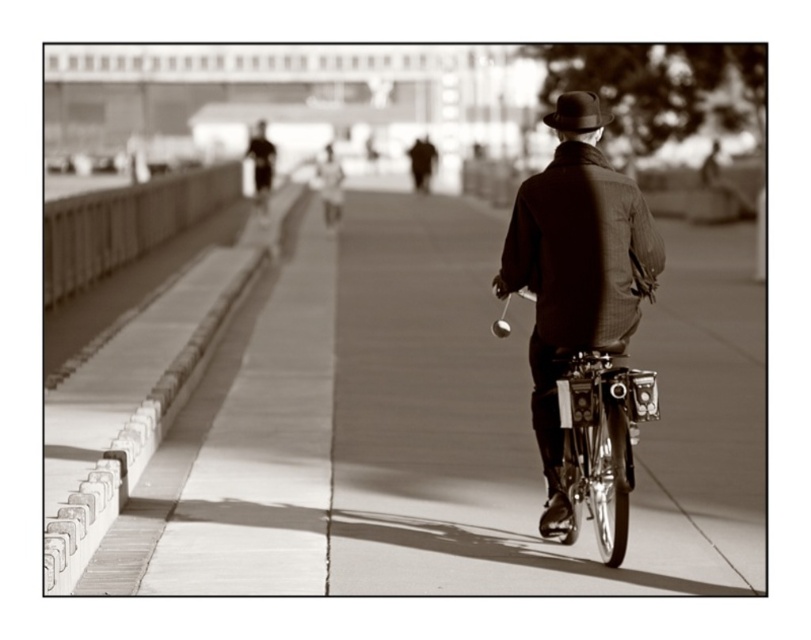
Question: Does smooth concrete pavement at center appear under matte brown jacket at center?

Choices:
 (A) no
 (B) yes

Answer: (B)

Question: Is the position of smooth concrete pavement at center more distant than that of dark brown felt hat at upper center?

Choices:
 (A) yes
 (B) no

Answer: (B)

Question: Where is matte brown jacket at center located in relation to dark brown felt hat at upper center in the image?

Choices:
 (A) below
 (B) above

Answer: (A)

Question: Which object is the closest to the dark brown felt hat at upper center?

Choices:
 (A) smooth concrete pavement at center
 (B) matte brown jacket at center

Answer: (B)

Question: Which point appears closest to the camera in this image?

Choices:
 (A) (537, 246)
 (B) (642, 568)

Answer: (B)

Question: Which of the following is the farthest from the observer?

Choices:
 (A) (591, 330)
 (B) (604, 116)

Answer: (B)